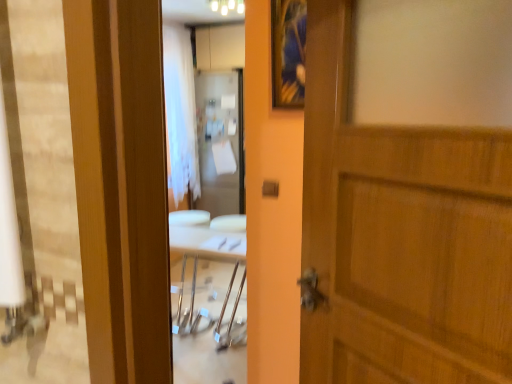
The image size is (512, 384). Find the location of `wooden framed picture at upper center`. wooden framed picture at upper center is located at coordinates (288, 52).

Where is `white glossy light fixture at upper center`? The width and height of the screenshot is (512, 384). white glossy light fixture at upper center is located at coordinates (227, 6).

What do you see at coordinates (180, 112) in the screenshot? I see `white sheer curtain at center` at bounding box center [180, 112].

Image resolution: width=512 pixels, height=384 pixels. I want to click on wooden framed picture at upper center, so click(288, 52).

Does wooden door at center have a smaller size compared to white glossy light fixture at upper center?

No, wooden door at center is not smaller than white glossy light fixture at upper center.

Between wooden door at center and white glossy light fixture at upper center, which one is positioned in front?

wooden door at center is more forward.

In the scene shown: Would you say wooden door at center is to the left or to the right of white glossy light fixture at upper center in the picture?

wooden door at center is to the right of white glossy light fixture at upper center.

Which is in front, point (329, 84) or point (234, 2)?

The point (329, 84) is closer to the camera.

From a real-world perspective, is white sheer curtain at center above or below wooden door at center?

In terms of real-world spatial position, white sheer curtain at center is above wooden door at center.

How distant is white sheer curtain at center from wooden door at center?

white sheer curtain at center is 3.34 meters from wooden door at center.

From the image's perspective, which object appears higher, white sheer curtain at center or wooden door at center?

white sheer curtain at center, from the image's perspective.

Is white sheer curtain at center smaller than wooden door at center?

Actually, white sheer curtain at center might be larger than wooden door at center.

From the image's perspective, who appears lower, wooden framed picture at upper center or white sheer curtain at center?

wooden framed picture at upper center appears lower in the image.

Find the location of `curtain below the wooden framed picture at upper center (from a real-world perspective)`. curtain below the wooden framed picture at upper center (from a real-world perspective) is located at coordinates (180, 112).

Is wooden framed picture at upper center bigger or smaller than white sheer curtain at center?

Considering their sizes, wooden framed picture at upper center takes up less space than white sheer curtain at center.

From their relative heights in the image, would you say wooden framed picture at upper center is taller or shorter than white sheer curtain at center?

wooden framed picture at upper center is shorter than white sheer curtain at center.

Considering the relative sizes of white glossy light fixture at upper center and white sheer curtain at center in the image provided, is white glossy light fixture at upper center taller than white sheer curtain at center?

No, white glossy light fixture at upper center is not taller than white sheer curtain at center.

Is white glossy light fixture at upper center not within white sheer curtain at center?

That's correct, white glossy light fixture at upper center is outside of white sheer curtain at center.

From a real-world perspective, is white glossy light fixture at upper center positioned over white sheer curtain at center based on gravity?

Yes, from a real-world perspective, white glossy light fixture at upper center is on top of white sheer curtain at center.

Based on the photo, considering the relative positions of wooden framed picture at upper center and wooden door at center in the image provided, is wooden framed picture at upper center to the left of wooden door at center from the viewer's perspective?

Yes.

Considering the sizes of wooden framed picture at upper center and wooden door at center in the image, is wooden framed picture at upper center taller or shorter than wooden door at center?

Clearly, wooden framed picture at upper center is shorter compared to wooden door at center.

From a real-world perspective, which is physically below, wooden framed picture at upper center or wooden door at center?

wooden door at center.

Is wooden framed picture at upper center inside or outside of wooden door at center?

wooden framed picture at upper center lies outside wooden door at center.

Is wooden door at center positioned behind white sheer curtain at center?

No, it is not.

Is wooden door at center completely or partially outside of white sheer curtain at center?

wooden door at center lies outside white sheer curtain at center's area.

Which object is thinner, wooden door at center or white sheer curtain at center?

wooden door at center.

Measure the distance from white glossy light fixture at upper center to wooden framed picture at upper center.

1.87 meters.

Considering the sizes of objects white glossy light fixture at upper center and wooden framed picture at upper center in the image provided, who is wider, white glossy light fixture at upper center or wooden framed picture at upper center?

Wider between the two is white glossy light fixture at upper center.

Would you say white glossy light fixture at upper center is outside wooden framed picture at upper center?

Yes.

Which point is more distant from viewer, (244, 8) or (277, 88)?

Positioned behind is point (244, 8).

You are a GUI agent. You are given a task and a screenshot of the screen. Output one action in this format:
    pyautogui.click(x=<x>, y=<y>)
    Task: Click on the door in front of the white glossy light fixture at upper center
    The image size is (512, 384).
    Given the screenshot: What is the action you would take?
    pyautogui.click(x=400, y=235)

Locate an element on the screen. The width and height of the screenshot is (512, 384). curtain above the wooden door at center (from the image's perspective) is located at coordinates (180, 112).

Looking at the image, which one is located further to white glossy light fixture at upper center, white sheer curtain at center or wooden framed picture at upper center?

Among the two, wooden framed picture at upper center is located further to white glossy light fixture at upper center.

Estimate the real-world distances between objects in this image. Which object is closer to wooden framed picture at upper center, wooden door at center or white glossy light fixture at upper center?

Based on the image, wooden door at center appears to be nearer to wooden framed picture at upper center.

When comparing their distances from white sheer curtain at center, does wooden framed picture at upper center or wooden door at center seem further?

wooden door at center.

Looking at the image, which one is located closer to wooden door at center, white sheer curtain at center or wooden framed picture at upper center?

Based on the image, wooden framed picture at upper center appears to be nearer to wooden door at center.

Looking at this image, when comparing their distances from white sheer curtain at center, does wooden framed picture at upper center or white glossy light fixture at upper center seem further?

The object further to white sheer curtain at center is wooden framed picture at upper center.

Estimate the real-world distances between objects in this image. Which object is closer to wooden door at center, white glossy light fixture at upper center or wooden framed picture at upper center?

wooden framed picture at upper center is positioned closer to the anchor wooden door at center.

Estimate the real-world distances between objects in this image. Which object is further from wooden door at center, wooden framed picture at upper center or white glossy light fixture at upper center?

white glossy light fixture at upper center is further to wooden door at center.

Considering their positions, is white sheer curtain at center positioned closer to wooden framed picture at upper center than wooden door at center?

Among the two, wooden door at center is located nearer to wooden framed picture at upper center.

Identify the location of light fixture located between wooden framed picture at upper center and white sheer curtain at center in the depth direction. (227, 6).

In order to click on light fixture between wooden door at center and white sheer curtain at center from front to back in this screenshot , I will do `click(227, 6)`.

Where is `picture frame between wooden door at center and white sheer curtain at center along the z-axis`? This screenshot has height=384, width=512. picture frame between wooden door at center and white sheer curtain at center along the z-axis is located at coordinates (288, 52).

Where is `picture frame located between wooden door at center and white glossy light fixture at upper center in the depth direction`? The width and height of the screenshot is (512, 384). picture frame located between wooden door at center and white glossy light fixture at upper center in the depth direction is located at coordinates (x=288, y=52).